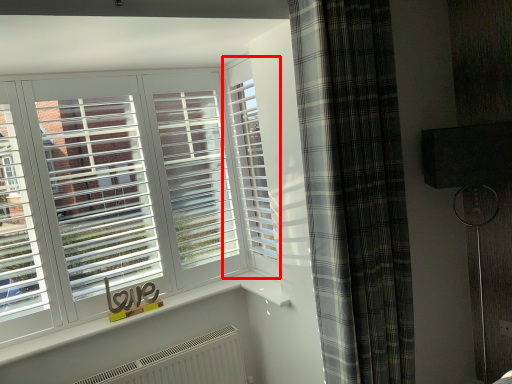
Question: Observing the image, what is the correct spatial positioning of window (annotated by the red box) in reference to curtain?

Choices:
 (A) left
 (B) right

Answer: (A)